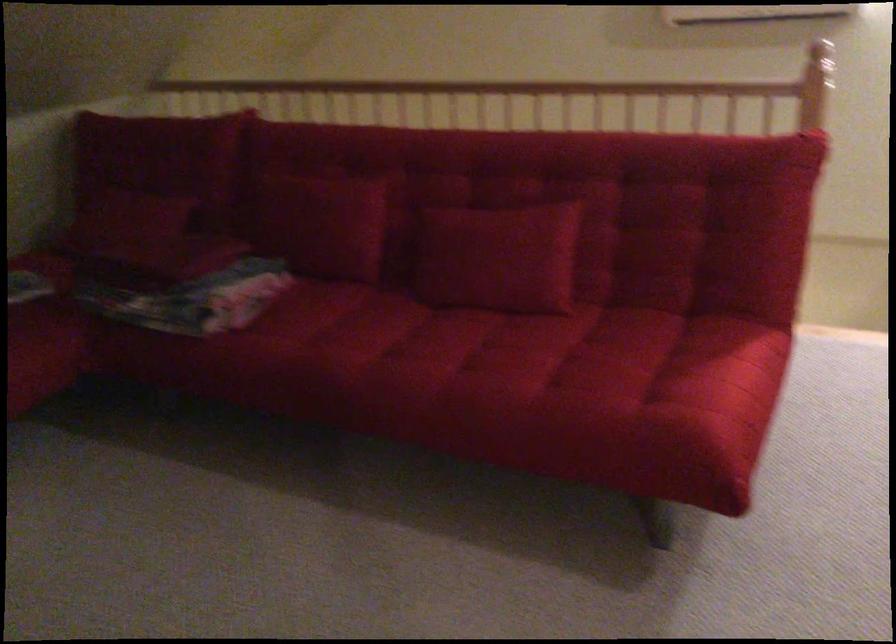
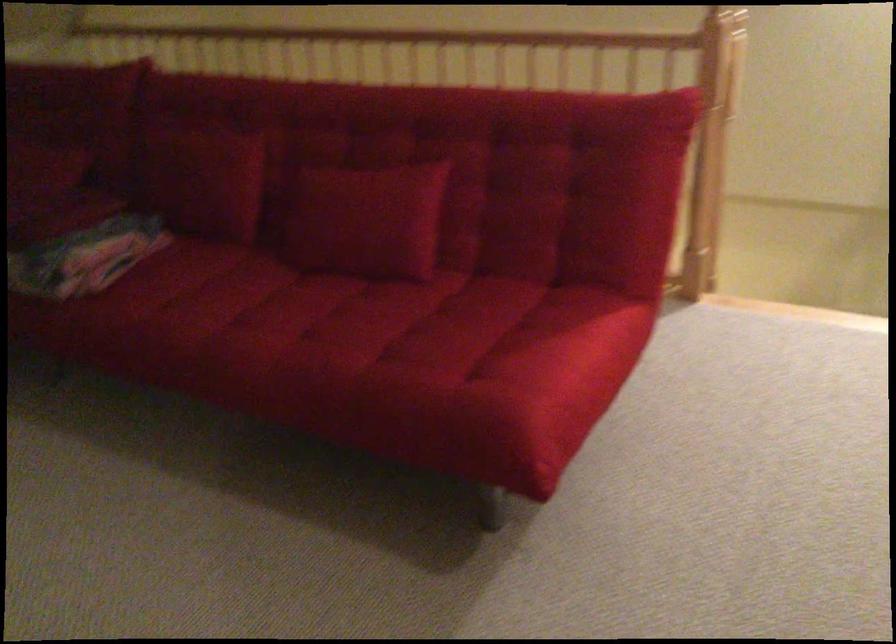
Question: The images are taken continuously from a first-person perspective. In which direction are you moving?

Choices:
 (A) Left
 (B) Right
 (C) Forward
 (D) Backward

Answer: (B)